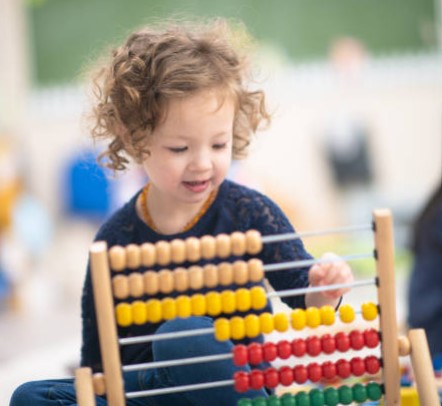
Find the location of a particular element. The image size is (442, 406). abacus bead in second row down is located at coordinates (118, 283), (135, 284), (153, 285), (164, 283), (183, 280), (195, 279), (211, 278), (226, 277), (241, 275), (255, 274).